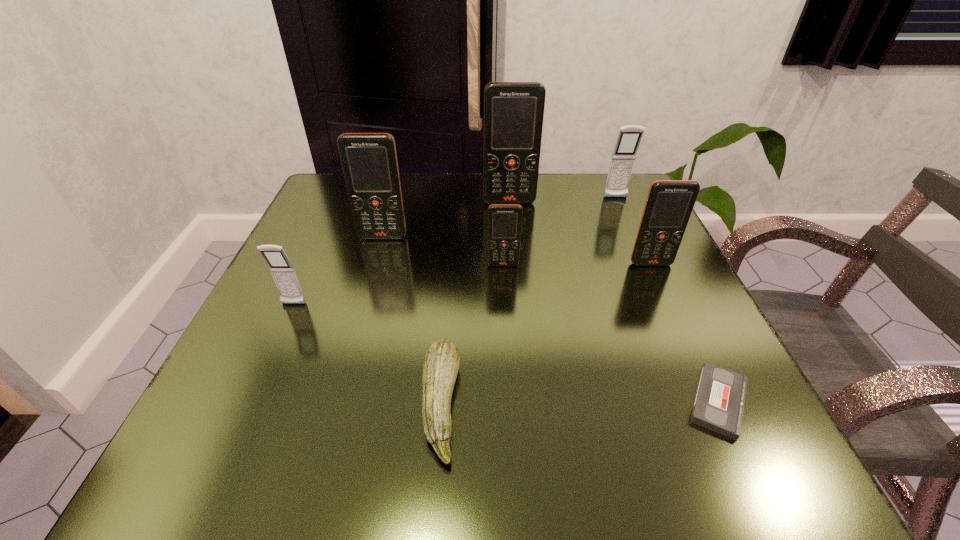
At what (x,y) coordinates should I click in order to perform the action: click on the sixth object from right to left. Please return your answer as a coordinate pair (x, y). This screenshot has height=540, width=960. Looking at the image, I should click on (441, 364).

I want to click on the second shortest object, so click(x=441, y=364).

This screenshot has height=540, width=960. I want to click on videotape, so click(x=719, y=403).

Image resolution: width=960 pixels, height=540 pixels. Find the location of `free space located 0.070m on the screen of the biggest orange cellular telephone`. free space located 0.070m on the screen of the biggest orange cellular telephone is located at coordinates (512, 223).

In order to click on vacant space positioned 0.070m on the screen of the seventh shortest object in this screenshot , I will do `click(375, 262)`.

Where is `vacant position located on the front-facing side of the bigger gray cellular telephone`? vacant position located on the front-facing side of the bigger gray cellular telephone is located at coordinates (665, 310).

Locate an element on the screen. Image resolution: width=960 pixels, height=540 pixels. vacant area located 0.180m on the screen of the third biggest orange cellular telephone is located at coordinates (685, 339).

The width and height of the screenshot is (960, 540). I want to click on vacant space located 0.150m on the screen of the smallest orange cellular telephone, so click(507, 325).

Locate an element on the screen. Image resolution: width=960 pixels, height=540 pixels. vacant region located on the front-facing side of the leftmost cellular telephone is located at coordinates (280, 334).

This screenshot has height=540, width=960. I want to click on vacant space situated 0.350m at the stem end of the sixth object from right to left, so click(708, 405).